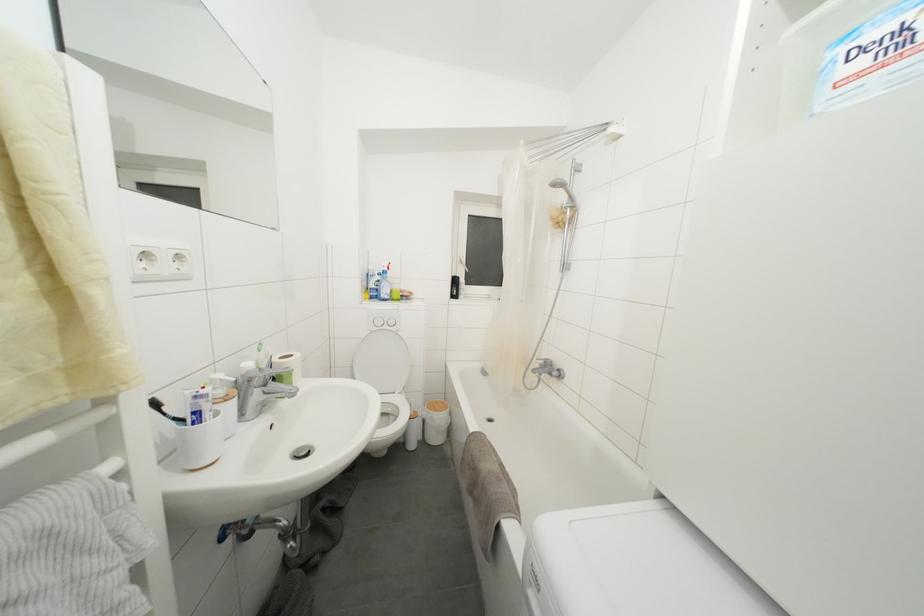
Identify the location of silver faucet handle. (542, 360).